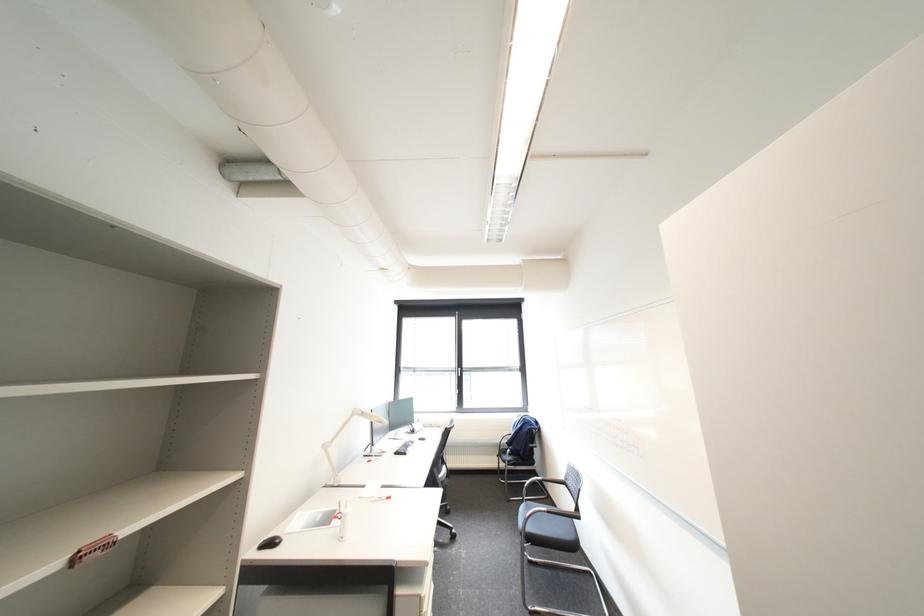
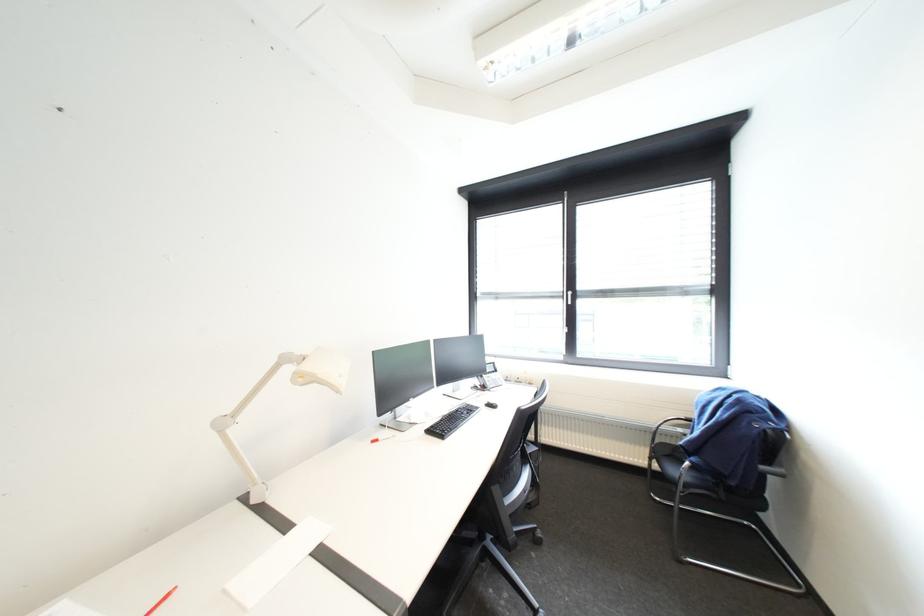
Question: In a continuous first-person perspective shot, in which direction is the camera moving?

Choices:
 (A) Left
 (B) Right
 (C) Forward
 (D) Backward

Answer: (C)